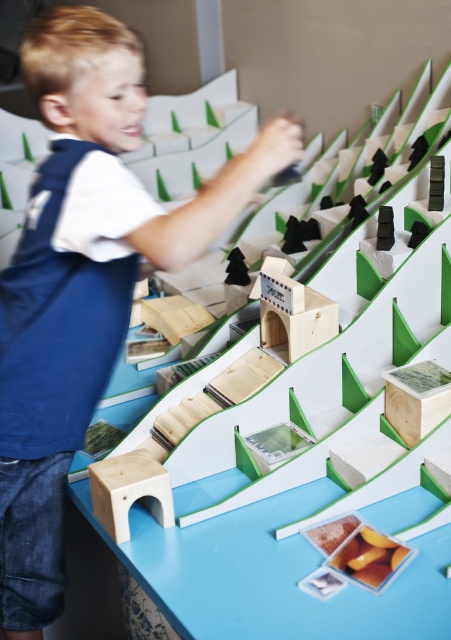
You are a parent trying to place a small toy car on the blue wood table at center. According to the image, where exactly should you place the toy car?

The blue wood table at center is located at point coordinates of (303, 456), so you should place the toy car there.

You are a toy designer trying to create a new accessory for the wooden train set. The accessory needs to be placed between the blue wood table at center and the blue denim jeans at lower left. What is the maximum length this accessory can be without overlapping either object?

The blue wood table at center is 19.85 inches from the blue denim jeans at lower left. Therefore, the maximum length the accessory can be is just under 19.85 inches to ensure it fits between them without overlapping either object.

You are a photographer standing 1.04 meters away from the blue wood table at center. You want to take a photo of the train set on the table. Can you fit the entire train set into your camera frame without moving closer or farther away?

The blue wood table at center and camera are 1.04 meters apart. Since the distance matches the required focal length for capturing the entire train set, yes, you can fit the entire train set into your camera frame without moving.